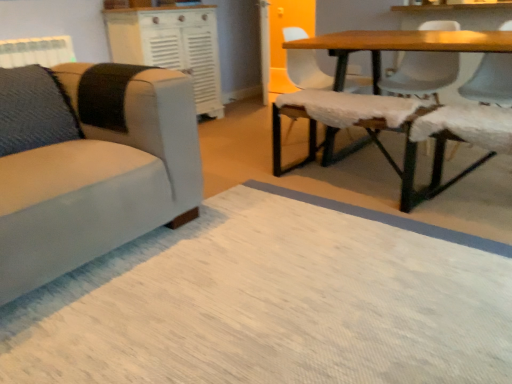
You are a GUI agent. You are given a task and a screenshot of the screen. Output one action in this format:
    pyautogui.click(x=<x>, y=<y>)
    Task: Click on the vacant space that is to the left of fur-covered bench at lower right
    The width and height of the screenshot is (512, 384).
    Given the screenshot: What is the action you would take?
    pyautogui.click(x=380, y=220)